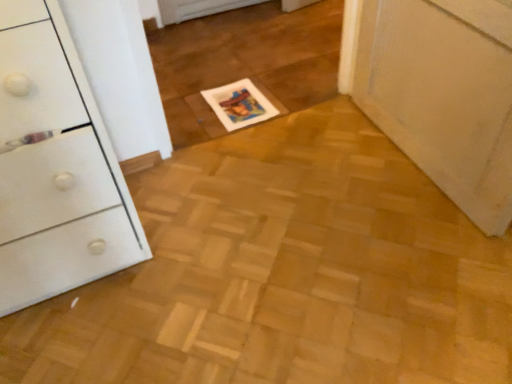
Question: Considering the positions of point (15, 1) and point (248, 84), is point (15, 1) closer or farther from the camera than point (248, 84)?

Choices:
 (A) farther
 (B) closer

Answer: (B)

Question: Is white glossy chest of drawers at left bigger or smaller than white glossy magazine at center?

Choices:
 (A) small
 (B) big

Answer: (B)

Question: Looking at their shapes, would you say white glossy chest of drawers at left is wider or thinner than white glossy magazine at center?

Choices:
 (A) wide
 (B) thin

Answer: (A)

Question: From a real-world perspective, is white glossy magazine at center physically located above or below white glossy chest of drawers at left?

Choices:
 (A) below
 (B) above

Answer: (A)

Question: Considering the relative positions of white glossy magazine at center and white glossy chest of drawers at left in the image provided, is white glossy magazine at center to the left or to the right of white glossy chest of drawers at left?

Choices:
 (A) left
 (B) right

Answer: (B)

Question: Is white glossy magazine at center taller or shorter than white glossy chest of drawers at left?

Choices:
 (A) short
 (B) tall

Answer: (A)

Question: Considering the positions of point (243, 79) and point (10, 297), is point (243, 79) closer or farther from the camera than point (10, 297)?

Choices:
 (A) farther
 (B) closer

Answer: (A)